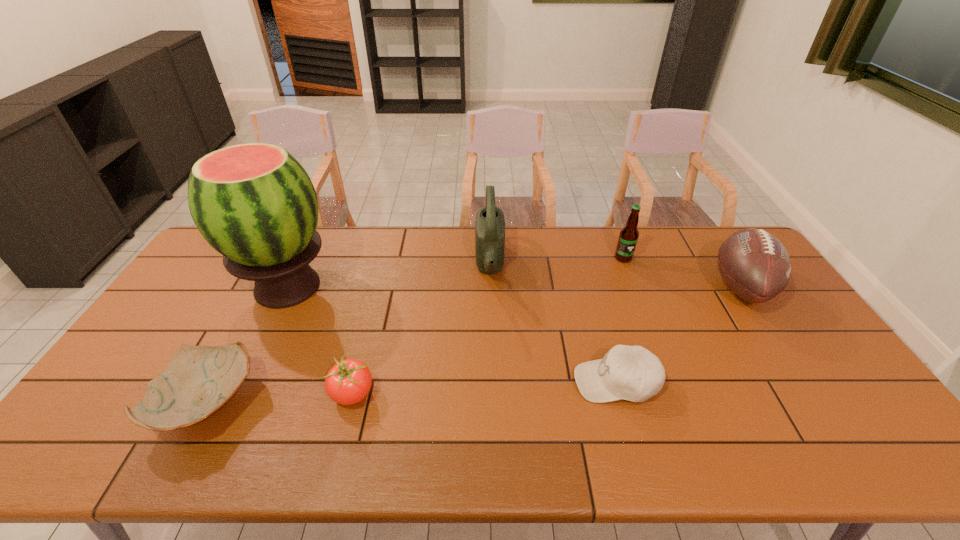
In order to click on free spot located on the spout of the watering can in this screenshot , I will do `click(394, 265)`.

This screenshot has width=960, height=540. Identify the location of vacant area situated 0.250m on the label of the beer bottle. 646,316.

Where is `vacant space positioned 0.170m on the front of the rightmost object`? The image size is (960, 540). vacant space positioned 0.170m on the front of the rightmost object is located at coordinates (795, 368).

Find the location of a particular element. This screenshot has width=960, height=540. free space located 0.090m on the front-facing side of the baseball cap is located at coordinates (540, 382).

In order to click on free space located 0.300m on the front-facing side of the baseball cap in this screenshot , I will do `click(459, 382)`.

You are a GUI agent. You are given a task and a screenshot of the screen. Output one action in this format:
    pyautogui.click(x=<x>, y=<y>)
    Task: Click on the vacant space situated 0.350m on the front-facing side of the baseball cap
    The image size is (960, 540).
    Given the screenshot: What is the action you would take?
    pyautogui.click(x=440, y=382)

Identify the location of vacant space located 0.080m on the front of the tomato. (339, 447).

You are a GUI agent. You are given a task and a screenshot of the screen. Output one action in this format:
    pyautogui.click(x=<x>, y=<y>)
    Task: Click on the vacant space situated on the right of the pottery
    The height and width of the screenshot is (540, 960).
    Given the screenshot: What is the action you would take?
    pyautogui.click(x=400, y=406)

Locate an element on the screen. This screenshot has height=540, width=960. watermelon located at the far edge is located at coordinates (254, 203).

The image size is (960, 540). What are the coordinates of `watering can that is at the far edge` in the screenshot? It's located at (490, 224).